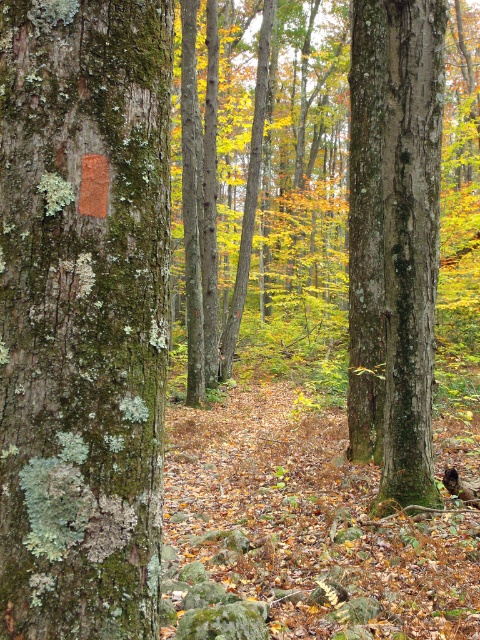
Question: Which point appears farthest from the camera in this image?

Choices:
 (A) (29, 12)
 (B) (372, 106)

Answer: (B)

Question: Does green mossy bark at left appear on the right side of green rough bark tree trunk at center?

Choices:
 (A) yes
 (B) no

Answer: (B)

Question: Can you confirm if green mossy bark at left is thinner than green rough bark tree trunk at center?

Choices:
 (A) no
 (B) yes

Answer: (B)

Question: Does green mossy bark at left have a lesser width compared to green rough bark tree trunk at center?

Choices:
 (A) yes
 (B) no

Answer: (A)